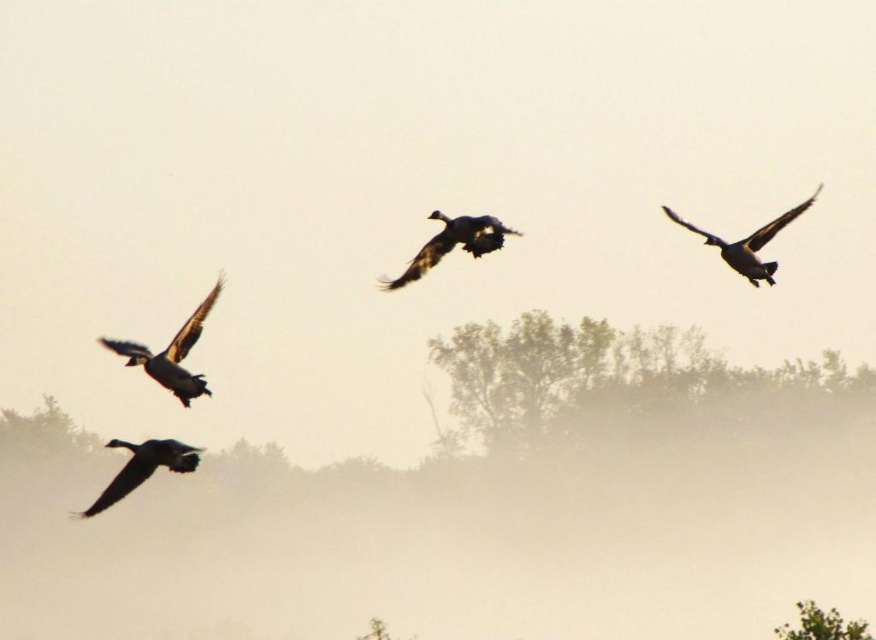
You are an ornithologist observing the geese in the image. You notice two groups of dark gray feathers at left and dark gray feathers at center. Which group has a larger size?

The dark gray feathers at left is bigger than dark gray feathers at center.